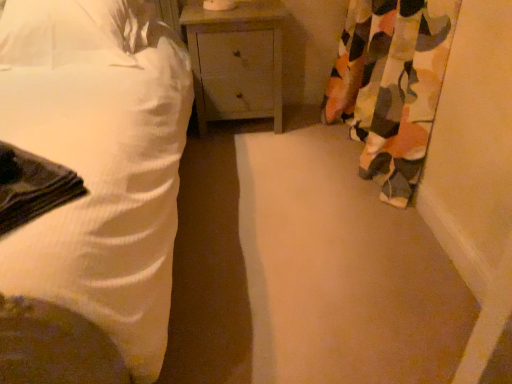
Question: Is white textured bed at left completely or partially outside of white fabric pillow at upper left?

Choices:
 (A) no
 (B) yes

Answer: (B)

Question: Is white textured bed at left smaller than white fabric pillow at upper left?

Choices:
 (A) yes
 (B) no

Answer: (B)

Question: Does white textured bed at left appear on the left side of white fabric pillow at upper left?

Choices:
 (A) yes
 (B) no

Answer: (A)

Question: Are white textured bed at left and white fabric pillow at upper left far apart?

Choices:
 (A) no
 (B) yes

Answer: (A)

Question: From the image's perspective, is white textured bed at left above white fabric pillow at upper left?

Choices:
 (A) no
 (B) yes

Answer: (A)

Question: Is white textured bed at left at the right side of white fabric pillow at upper left?

Choices:
 (A) no
 (B) yes

Answer: (A)

Question: Does matte gray nightstand at center come in front of camouflage fabric curtain at right?

Choices:
 (A) yes
 (B) no

Answer: (B)

Question: Considering the relative sizes of matte gray nightstand at center and camouflage fabric curtain at right in the image provided, is matte gray nightstand at center smaller than camouflage fabric curtain at right?

Choices:
 (A) no
 (B) yes

Answer: (B)

Question: Is matte gray nightstand at center oriented towards camouflage fabric curtain at right?

Choices:
 (A) no
 (B) yes

Answer: (A)

Question: Is camouflage fabric curtain at right inside matte gray nightstand at center?

Choices:
 (A) no
 (B) yes

Answer: (A)

Question: Does matte gray nightstand at center have a greater width compared to camouflage fabric curtain at right?

Choices:
 (A) yes
 (B) no

Answer: (A)

Question: From the image's perspective, does matte gray nightstand at center appear higher than camouflage fabric curtain at right?

Choices:
 (A) yes
 (B) no

Answer: (A)

Question: From a real-world perspective, is white textured bed at left positioned over matte gray nightstand at center based on gravity?

Choices:
 (A) yes
 (B) no

Answer: (A)